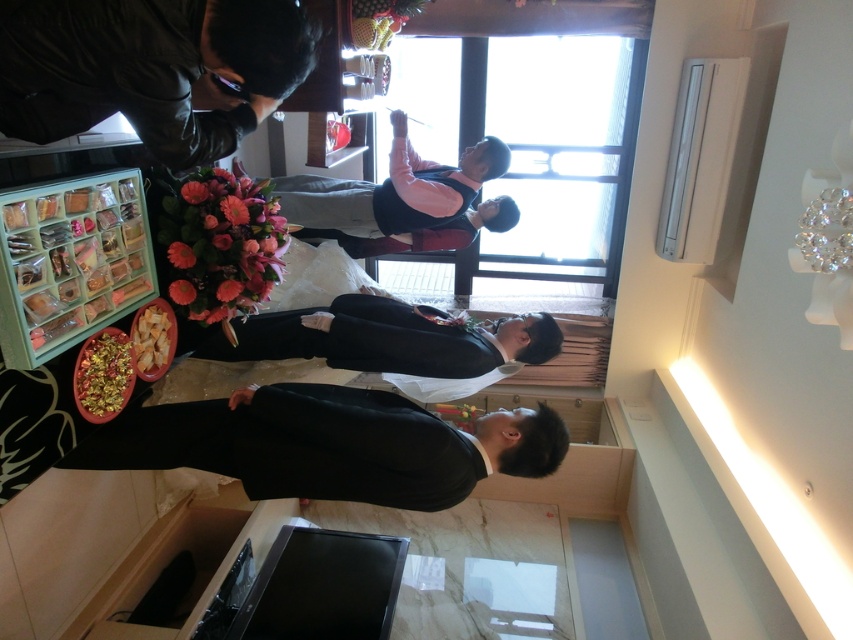
Based on the photo, you are at a wedding reception and need to place a small vase on the table. The shiny gold tray at lower left and golden textured chips at lower left are already there. Which object has enough space to place the vase next to it without moving other items?

The shiny gold tray at lower left has a greater width than the golden textured chips at lower left, so placing the vase next to it would provide more space.

You are a photographer at a wedding reception. You need to capture a photo that includes both the pink velvet dress at center and the shiny gold tray at lower left. Which object should you focus on first to ensure both are in frame?

The pink velvet dress at center is closer to the viewer than the shiny gold tray at lower left, so you should focus on the pink velvet dress at center first to ensure both are in frame.

You are taking a photo of the scene and want to focus on both point (x=125, y=372) and point (x=149, y=369). Which point should you focus on first to ensure both are in sharp focus?

Point (x=125, y=372) is closer to the camera than point (x=149, y=369), so focusing on the closer point first will help ensure both are in sharp focus.